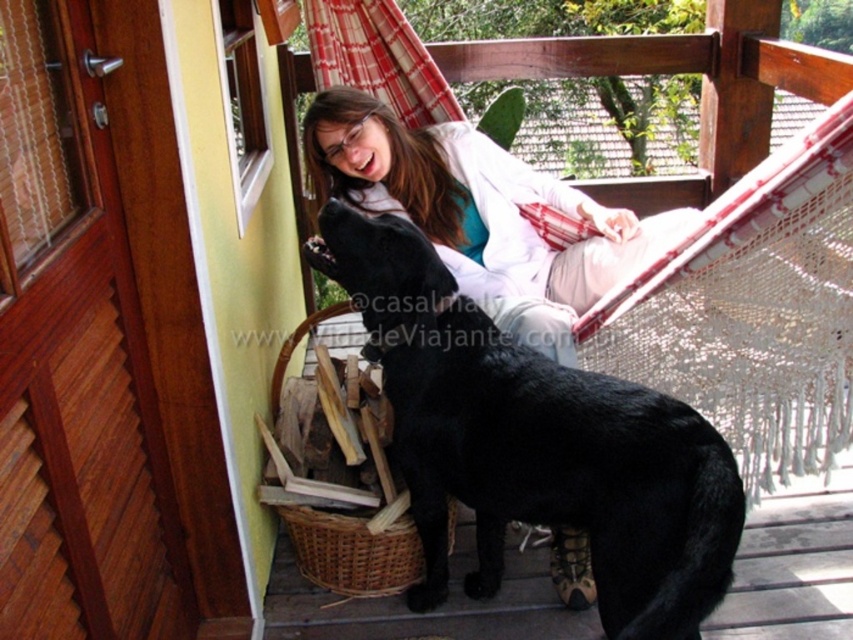
Question: Which point is farther from the camera taking this photo?

Choices:
 (A) (386, 374)
 (B) (460, 236)

Answer: (B)

Question: Is black glossy fur at lower center below matte white coat at upper center?

Choices:
 (A) yes
 (B) no

Answer: (A)

Question: Where is black glossy fur at lower center located in relation to matte white coat at upper center in the image?

Choices:
 (A) left
 (B) right

Answer: (A)

Question: Is black glossy fur at lower center smaller than matte white coat at upper center?

Choices:
 (A) no
 (B) yes

Answer: (A)

Question: Among these points, which one is nearest to the camera?

Choices:
 (A) (437, 556)
 (B) (517, 212)

Answer: (A)